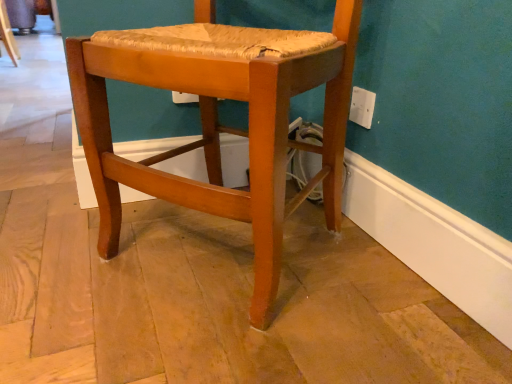
Where is `white plastic electric outlet at upper right`? This screenshot has width=512, height=384. white plastic electric outlet at upper right is located at coordinates (362, 107).

In order to face white plastic electric outlet at upper right, should I rotate leftwards or rightwards?

To face it directly, rotate right by 13.893 degrees.

Describe the element at coordinates (362, 107) in the screenshot. The width and height of the screenshot is (512, 384). I see `white plastic electric outlet at upper right` at that location.

Where is `matte wood chair at center`? Image resolution: width=512 pixels, height=384 pixels. matte wood chair at center is located at coordinates (218, 123).

This screenshot has width=512, height=384. What do you see at coordinates (218, 123) in the screenshot?
I see `matte wood chair at center` at bounding box center [218, 123].

What are the coordinates of `white plastic electric outlet at upper right` in the screenshot? It's located at (362, 107).

Which is more to the right, matte wood chair at center or white plastic electric outlet at upper right?

white plastic electric outlet at upper right is more to the right.

Is matte wood chair at center further to camera compared to white plastic electric outlet at upper right?

That is False.

Considering the positions of point (250, 78) and point (368, 95), is point (250, 78) closer or farther from the camera than point (368, 95)?

Point (250, 78).

From the image's perspective, would you say matte wood chair at center is positioned over white plastic electric outlet at upper right?

No.

From a real-world perspective, is matte wood chair at center positioned above or below white plastic electric outlet at upper right?

matte wood chair at center is situated lower than white plastic electric outlet at upper right in the real world.

Considering the sizes of objects matte wood chair at center and white plastic electric outlet at upper right in the image provided, who is wider, matte wood chair at center or white plastic electric outlet at upper right?

With larger width is matte wood chair at center.

Considering the sizes of objects matte wood chair at center and white plastic electric outlet at upper right in the image provided, who is taller, matte wood chair at center or white plastic electric outlet at upper right?

matte wood chair at center is taller.

Considering the sizes of objects matte wood chair at center and white plastic electric outlet at upper right in the image provided, who is smaller, matte wood chair at center or white plastic electric outlet at upper right?

white plastic electric outlet at upper right.

Can white plastic electric outlet at upper right be found inside matte wood chair at center?

That's incorrect, white plastic electric outlet at upper right is not inside matte wood chair at center.

Looking at this image, is matte wood chair at center next to white plastic electric outlet at upper right?

No.

Is matte wood chair at center aimed at white plastic electric outlet at upper right?

No, matte wood chair at center is not oriented towards white plastic electric outlet at upper right.

Measure the distance between matte wood chair at center and white plastic electric outlet at upper right.

matte wood chair at center is 17.07 inches from white plastic electric outlet at upper right.

I want to click on chair in front of the white plastic electric outlet at upper right, so click(218, 123).

Looking at this image, considering the relative positions of white plastic electric outlet at upper right and matte wood chair at center in the image provided, is white plastic electric outlet at upper right to the right of matte wood chair at center from the viewer's perspective?

Correct, you'll find white plastic electric outlet at upper right to the right of matte wood chair at center.

Is the position of white plastic electric outlet at upper right less distant than that of matte wood chair at center?

No, white plastic electric outlet at upper right is further to the viewer.

Considering the points (370, 122) and (261, 102), which point is behind, point (370, 122) or point (261, 102)?

Point (370, 122)

Consider the image. From the image's perspective, is white plastic electric outlet at upper right above matte wood chair at center?

Yes, from the image's perspective, white plastic electric outlet at upper right is on top of matte wood chair at center.

From a real-world perspective, between white plastic electric outlet at upper right and matte wood chair at center, who is vertically lower?

matte wood chair at center, from a real-world perspective.

Is white plastic electric outlet at upper right wider or thinner than matte wood chair at center?

In the image, white plastic electric outlet at upper right appears to be more narrow than matte wood chair at center.

Who is taller, white plastic electric outlet at upper right or matte wood chair at center?

Standing taller between the two is matte wood chair at center.

Which of these two, white plastic electric outlet at upper right or matte wood chair at center, is smaller?

With smaller size is white plastic electric outlet at upper right.

Is matte wood chair at center completely or partially inside white plastic electric outlet at upper right?

Actually, matte wood chair at center is outside white plastic electric outlet at upper right.

Consider the image. Is white plastic electric outlet at upper right positioned far away from matte wood chair at center?

They are positioned close to each other.

Is white plastic electric outlet at upper right aimed at matte wood chair at center?

Yes, white plastic electric outlet at upper right is aimed at matte wood chair at center.

How many degrees apart are the facing directions of white plastic electric outlet at upper right and matte wood chair at center?

There is a 35.8-degree angle between the facing directions of white plastic electric outlet at upper right and matte wood chair at center.

Measure the distance between white plastic electric outlet at upper right and matte wood chair at center.

17.07 inches.

The height and width of the screenshot is (384, 512). I want to click on chair located below the white plastic electric outlet at upper right (from the image's perspective), so click(218, 123).

The image size is (512, 384). Find the location of `electric outlet that is on the right side of matte wood chair at center`. electric outlet that is on the right side of matte wood chair at center is located at coordinates (362, 107).

Identify the location of chair in front of the white plastic electric outlet at upper right. This screenshot has width=512, height=384. (218, 123).